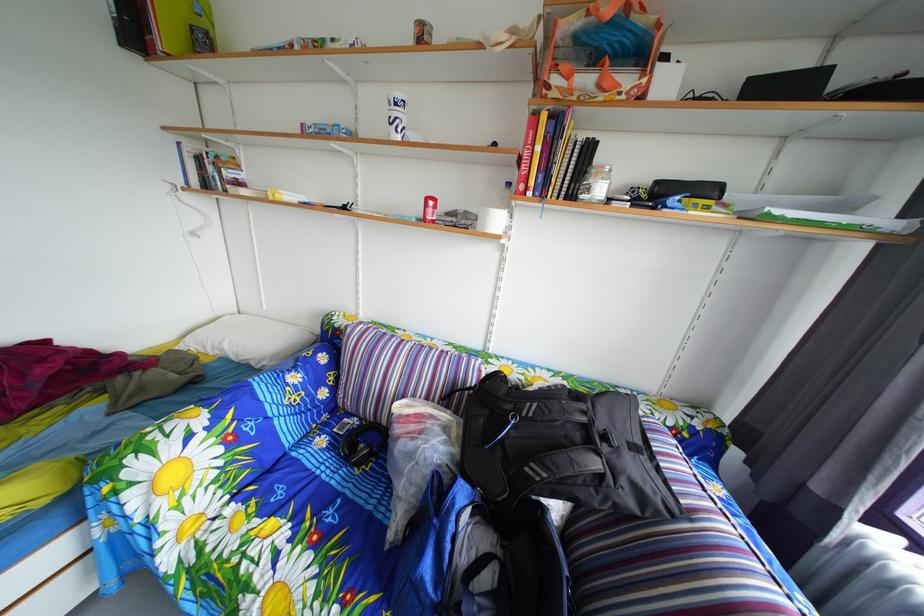
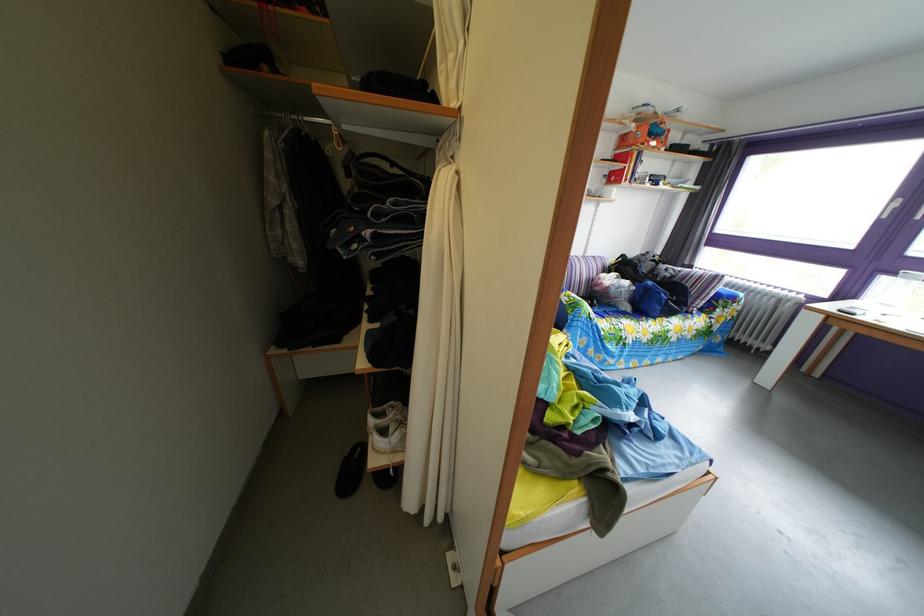
The point at (x=497, y=349) is marked in the first image. Where is the corresponding point in the second image?

(596, 261)